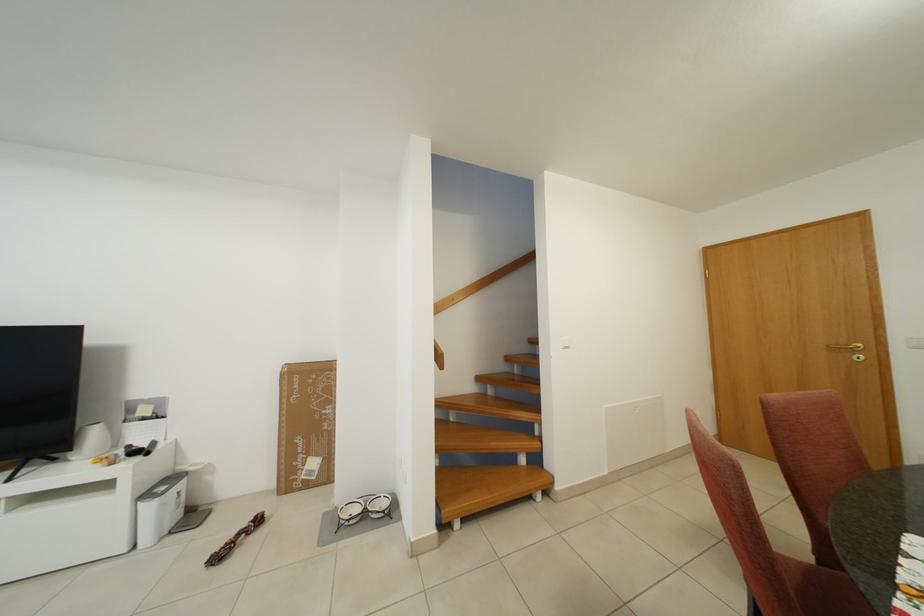
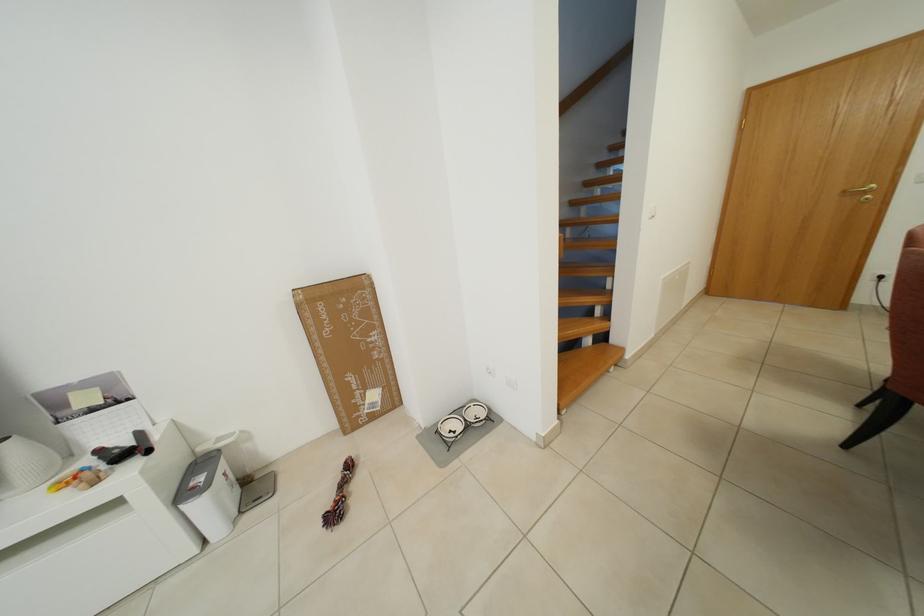
Where in the second image is the point corresponding to (x=103, y=439) from the first image?

(21, 460)